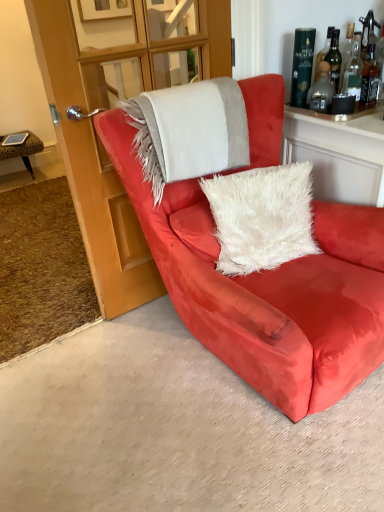
Question: Based on their positions, is transparent glass door at upper center located to the left or right of green glass bottle at upper right, which is counted as the 1th bottle, starting from the left?

Choices:
 (A) right
 (B) left

Answer: (B)

Question: Would you say transparent glass door at upper center is inside or outside green glass bottle at upper right, arranged as the third bottle when viewed from the right?

Choices:
 (A) outside
 (B) inside

Answer: (A)

Question: Estimate the real-world distances between objects in this image. Which object is closer to the leopard print fabric stool at left?

Choices:
 (A) transparent glass door at upper center
 (B) satin red armchair at center
 (C) translucent glass bottle at upper right, the 2th bottle when ordered from left to right
 (D) translucent amber glass bottle at upper right, the 1th bottle in the right-to-left sequence
 (E) green glass bottle at upper right, arranged as the third bottle when viewed from the right

Answer: (A)

Question: Considering the real-world distances, which object is farthest from the satin red armchair at center?

Choices:
 (A) leopard print fabric stool at left
 (B) green glass bottle at upper right, arranged as the third bottle when viewed from the right
 (C) translucent amber glass bottle at upper right, the 1th bottle in the right-to-left sequence
 (D) translucent glass bottle at upper right, which is the 2th bottle from right to left
 (E) transparent glass door at upper center

Answer: (A)